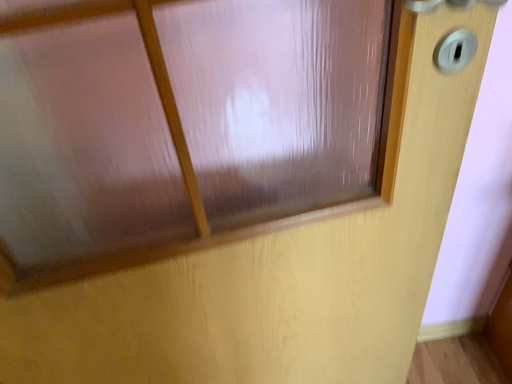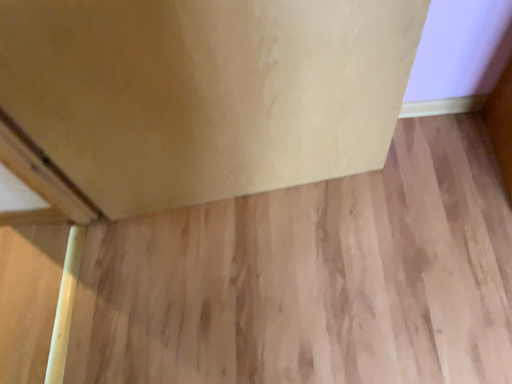
Question: How did the camera likely rotate when shooting the video?

Choices:
 (A) rotated upward
 (B) rotated downward

Answer: (B)